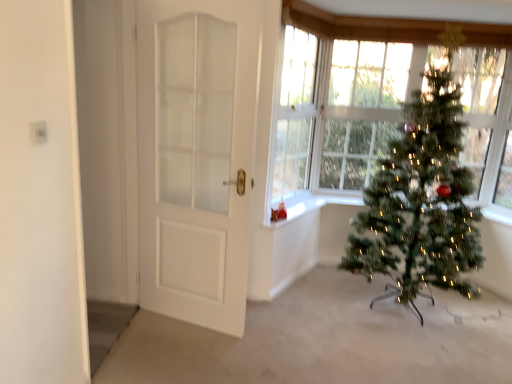
Question: From a real-world perspective, is clear glass window at center physically located above or below white matte door at left?

Choices:
 (A) above
 (B) below

Answer: (A)

Question: From the image's perspective, relative to white matte door at left, is clear glass window at center above or below?

Choices:
 (A) above
 (B) below

Answer: (A)

Question: Which of these objects is positioned closest to the white matte door at left?

Choices:
 (A) white glossy window sill at center
 (B) green artificial christmas tree at right
 (C) clear glass window at center

Answer: (C)

Question: Which is nearer to the white glossy window sill at center?

Choices:
 (A) green artificial christmas tree at right
 (B) clear glass window at center
 (C) white matte door at left

Answer: (B)